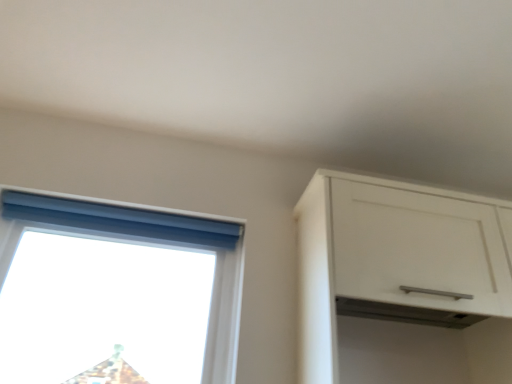
Describe the element at coordinates (116, 293) in the screenshot. I see `transparent plastic window at upper left` at that location.

In order to face blue fabric curtain at upper left, should I rotate leftwards or rightwards?

To face it directly, rotate left by 16.878 degrees.

Where is `transparent plastic window at upper left`? Image resolution: width=512 pixels, height=384 pixels. transparent plastic window at upper left is located at coordinates (116, 293).

Looking at this image, which object is positioned more to the right, blue fabric curtain at upper left or transparent plastic window at upper left?

blue fabric curtain at upper left is more to the right.

Image resolution: width=512 pixels, height=384 pixels. I want to click on window located underneath the blue fabric curtain at upper left (from a real-world perspective), so click(116, 293).

Who is bigger, blue fabric curtain at upper left or transparent plastic window at upper left?

Bigger between the two is transparent plastic window at upper left.

From their relative heights in the image, would you say blue fabric curtain at upper left is taller or shorter than white matte cabinet at upper right?

In the image, blue fabric curtain at upper left appears to be shorter than white matte cabinet at upper right.

From a real-world perspective, between blue fabric curtain at upper left and white matte cabinet at upper right, who is vertically lower?

white matte cabinet at upper right is physically lower.

Is blue fabric curtain at upper left outside of white matte cabinet at upper right?

Yes, blue fabric curtain at upper left is outside of white matte cabinet at upper right.

Is blue fabric curtain at upper left positioned with its back to white matte cabinet at upper right?

blue fabric curtain at upper left is not turned away from white matte cabinet at upper right.

Is white matte cabinet at upper right at the left side of transparent plastic window at upper left?

In fact, white matte cabinet at upper right is to the right of transparent plastic window at upper left.

From a real-world perspective, which object stands above the other?

In real-world perspective, white matte cabinet at upper right is above.

Is point (504, 247) farther from viewer compared to point (100, 354)?

That is False.

Which object is more forward, white matte cabinet at upper right or transparent plastic window at upper left?

white matte cabinet at upper right is in front.

Is point (57, 354) farther from camera compared to point (366, 241)?

That is True.

Is transparent plastic window at upper left directly adjacent to white matte cabinet at upper right?

No.

Is white matte cabinet at upper right inside transparent plastic window at upper left?

No, transparent plastic window at upper left does not contain white matte cabinet at upper right.

From the image's perspective, which object appears higher, white matte cabinet at upper right or blue fabric curtain at upper left?

blue fabric curtain at upper left.

Considering the positions of objects white matte cabinet at upper right and blue fabric curtain at upper left in the image provided, who is more to the left, white matte cabinet at upper right or blue fabric curtain at upper left?

Positioned to the left is blue fabric curtain at upper left.

Between white matte cabinet at upper right and blue fabric curtain at upper left, which one has larger size?

With larger size is white matte cabinet at upper right.

In the scene shown: Do you think white matte cabinet at upper right is within blue fabric curtain at upper left, or outside of it?

white matte cabinet at upper right is not inside blue fabric curtain at upper left, it's outside.

How distant is transparent plastic window at upper left from blue fabric curtain at upper left?

transparent plastic window at upper left is 7.57 inches from blue fabric curtain at upper left.

Can you tell me how much transparent plastic window at upper left and blue fabric curtain at upper left differ in facing direction?

The angle between the facing direction of transparent plastic window at upper left and the facing direction of blue fabric curtain at upper left is 0.000911 degrees.

Does transparent plastic window at upper left have a greater height compared to blue fabric curtain at upper left?

Yes.

Considering the sizes of objects transparent plastic window at upper left and blue fabric curtain at upper left in the image provided, who is bigger, transparent plastic window at upper left or blue fabric curtain at upper left?

transparent plastic window at upper left.

Find the location of a particular element. Image resolution: width=512 pixels, height=384 pixels. window located in front of the blue fabric curtain at upper left is located at coordinates (116, 293).

At what (x,y) coordinates should I click in order to perform the action: click on curtain on the left of the white matte cabinet at upper right. Please return your answer as a coordinate pair (x, y). The height and width of the screenshot is (384, 512). Looking at the image, I should click on tap(119, 219).

Considering their positions, is white matte cabinet at upper right positioned closer to transparent plastic window at upper left than blue fabric curtain at upper left?

blue fabric curtain at upper left is positioned closer to the anchor transparent plastic window at upper left.

Looking at the image, which one is located further to transparent plastic window at upper left, blue fabric curtain at upper left or white matte cabinet at upper right?

white matte cabinet at upper right is further to transparent plastic window at upper left.

Consider the image. Which object lies further to the anchor point white matte cabinet at upper right, transparent plastic window at upper left or blue fabric curtain at upper left?

transparent plastic window at upper left is positioned further to the anchor white matte cabinet at upper right.

Based on their spatial positions, is transparent plastic window at upper left or white matte cabinet at upper right further from blue fabric curtain at upper left?

The object further to blue fabric curtain at upper left is white matte cabinet at upper right.

Based on their spatial positions, is white matte cabinet at upper right or transparent plastic window at upper left further from blue fabric curtain at upper left?

Among the two, white matte cabinet at upper right is located further to blue fabric curtain at upper left.

Considering their positions, is blue fabric curtain at upper left positioned further to white matte cabinet at upper right than transparent plastic window at upper left?

The object further to white matte cabinet at upper right is transparent plastic window at upper left.

The height and width of the screenshot is (384, 512). What are the coordinates of `curtain between transparent plastic window at upper left and white matte cabinet at upper right from left to right` in the screenshot? It's located at (119, 219).